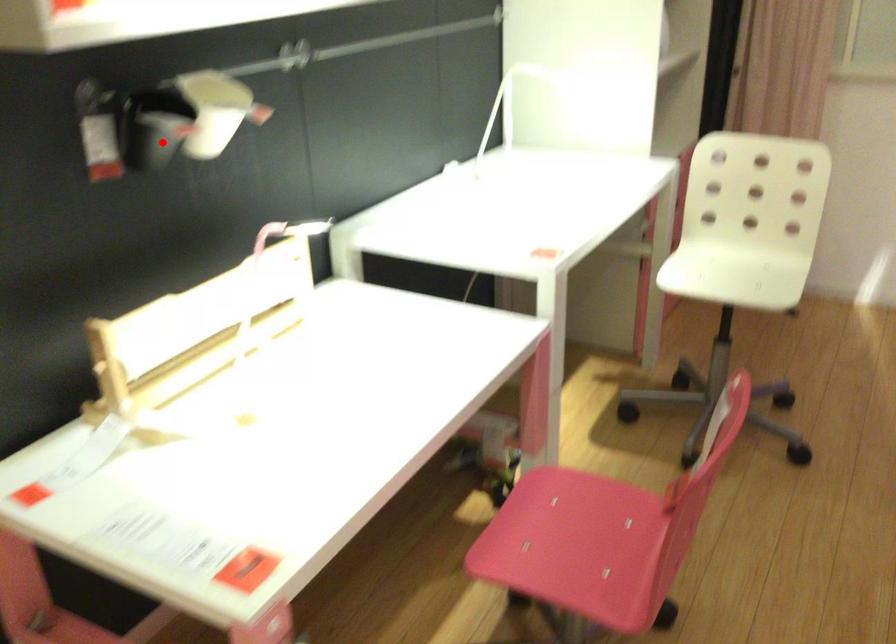
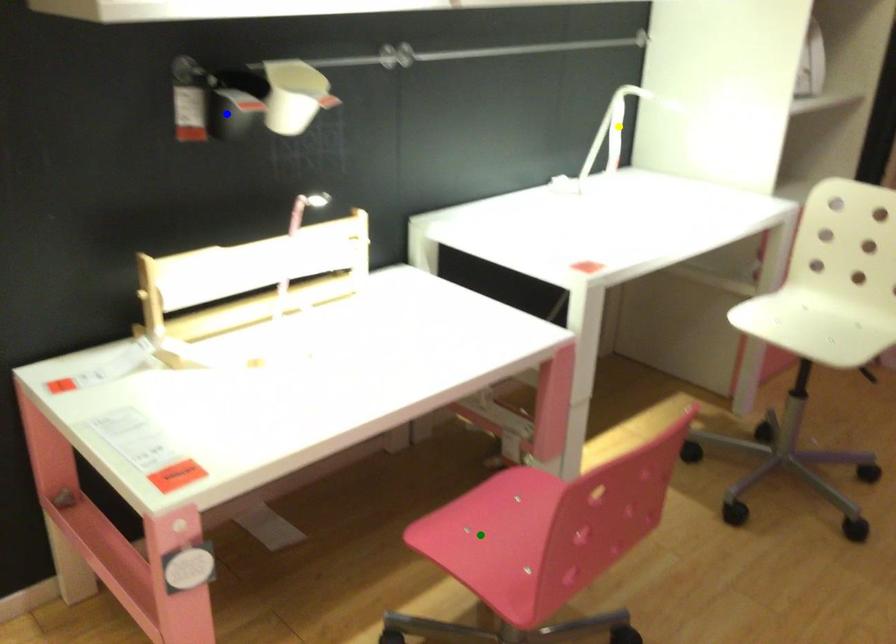
Question: I am providing you with two images of the same scene from different viewpoints. A red point is marked on the first image. You are given multiple points on the second image. Which point in image 2 represents the same 3d spot as the red point in image 1?

Choices:
 (A) green point
 (B) yellow point
 (C) blue point

Answer: (C)